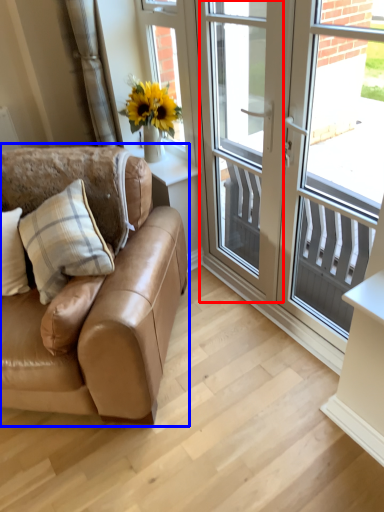
Question: Which object appears closest to the camera in this image, screen door (highlighted by a red box) or studio couch (highlighted by a blue box)?

Choices:
 (A) screen door
 (B) studio couch

Answer: (B)